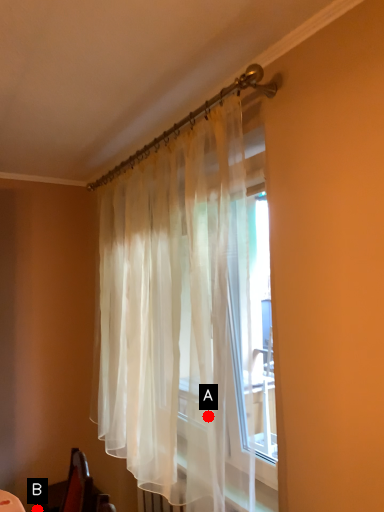
Question: Two points are circled on the image, labeled by A and B beside each circle. Which point is farther from the camera taking this photo?

Choices:
 (A) A is further
 (B) B is further

Answer: (B)